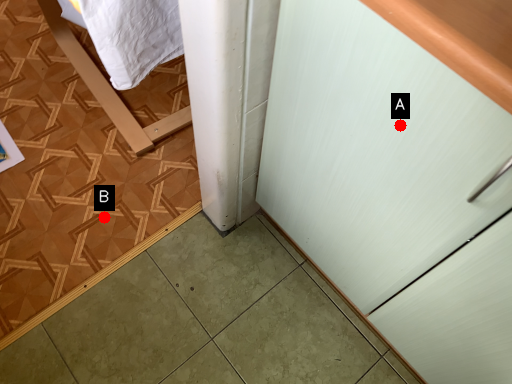
Question: Two points are circled on the image, labeled by A and B beside each circle. Which point is farther to the camera?

Choices:
 (A) A is further
 (B) B is further

Answer: (B)